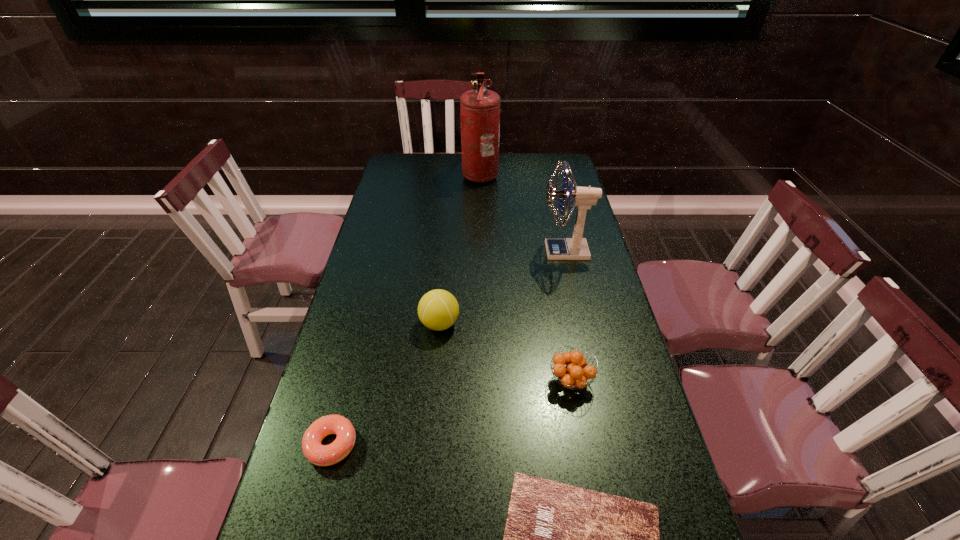
Locate an element on the screen. vacant area located 0.300m at the front of the tallest object where the nozzle is aimed is located at coordinates (392, 174).

At what (x,y) coordinates should I click in order to perform the action: click on free region located 0.190m at the front of the tallest object where the nozzle is aimed. Please return your answer as a coordinate pair (x, y). Looking at the image, I should click on (418, 174).

Locate an element on the screen. The width and height of the screenshot is (960, 540). blank area located 0.060m at the front of the tallest object where the nozzle is aimed is located at coordinates (448, 174).

Locate an element on the screen. vacant space located 0.250m on the front-facing side of the fifth nearest object is located at coordinates (468, 251).

Image resolution: width=960 pixels, height=540 pixels. What are the coordinates of `vacant space positioned on the front-facing side of the fifth nearest object` in the screenshot? It's located at (446, 251).

Identify the location of vacant area located 0.140m on the front-facing side of the fifth nearest object. (500, 251).

Where is `vacant region located 0.120m on the left of the fourth nearest object`? This screenshot has height=540, width=960. vacant region located 0.120m on the left of the fourth nearest object is located at coordinates (377, 323).

The width and height of the screenshot is (960, 540). What are the coordinates of `free space located on the left of the orange fruit` in the screenshot? It's located at (492, 381).

Image resolution: width=960 pixels, height=540 pixels. What are the coordinates of `blank area located on the back of the leftmost object` in the screenshot? It's located at (345, 395).

Where is `object that is at the far edge`? object that is at the far edge is located at coordinates (480, 108).